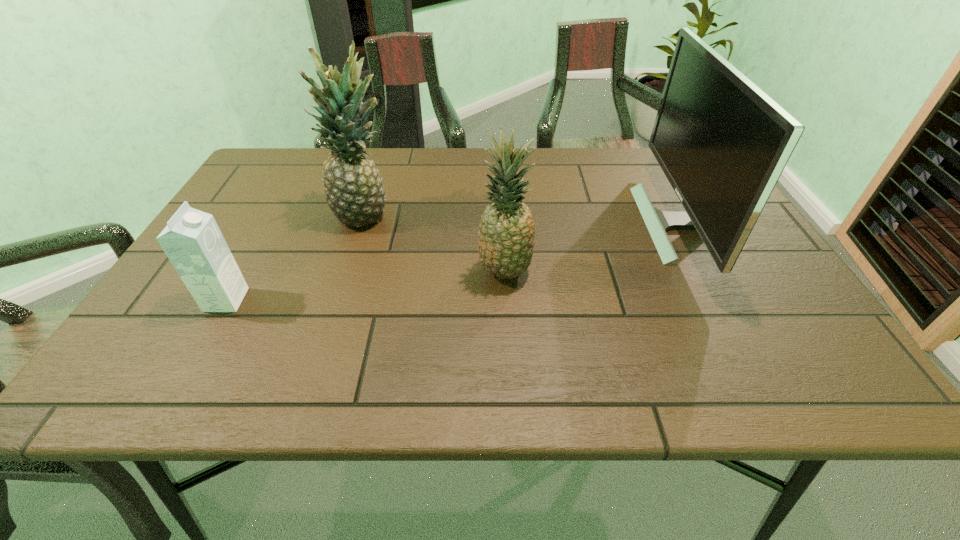
The image size is (960, 540). In order to click on free space located 0.160m on the screen side of the monitor in this screenshot , I will do `click(581, 224)`.

Where is `free region located 0.070m on the front of the right pineapple`? The height and width of the screenshot is (540, 960). free region located 0.070m on the front of the right pineapple is located at coordinates click(507, 316).

Where is `blank area located 0.050m on the front label of the leftmost object`? blank area located 0.050m on the front label of the leftmost object is located at coordinates (267, 300).

Locate an element on the screen. The height and width of the screenshot is (540, 960). object that is at the far edge is located at coordinates (723, 143).

At what (x,y) coordinates should I click in order to perform the action: click on object present at the left edge. Please return your answer as a coordinate pair (x, y). The width and height of the screenshot is (960, 540). Looking at the image, I should click on (192, 240).

The width and height of the screenshot is (960, 540). In order to click on object that is at the right edge in this screenshot , I will do `click(723, 143)`.

Find the location of `object that is at the far right corner`. object that is at the far right corner is located at coordinates (723, 143).

Where is `free space at the far edge of the desktop`? This screenshot has width=960, height=540. free space at the far edge of the desktop is located at coordinates (436, 154).

At what (x,y) coordinates should I click in order to perform the action: click on free space at the near edge of the desktop. Please return your answer as a coordinate pair (x, y). The image size is (960, 540). Looking at the image, I should click on (257, 368).

This screenshot has width=960, height=540. What are the coordinates of `free space at the left edge` in the screenshot? It's located at (230, 202).